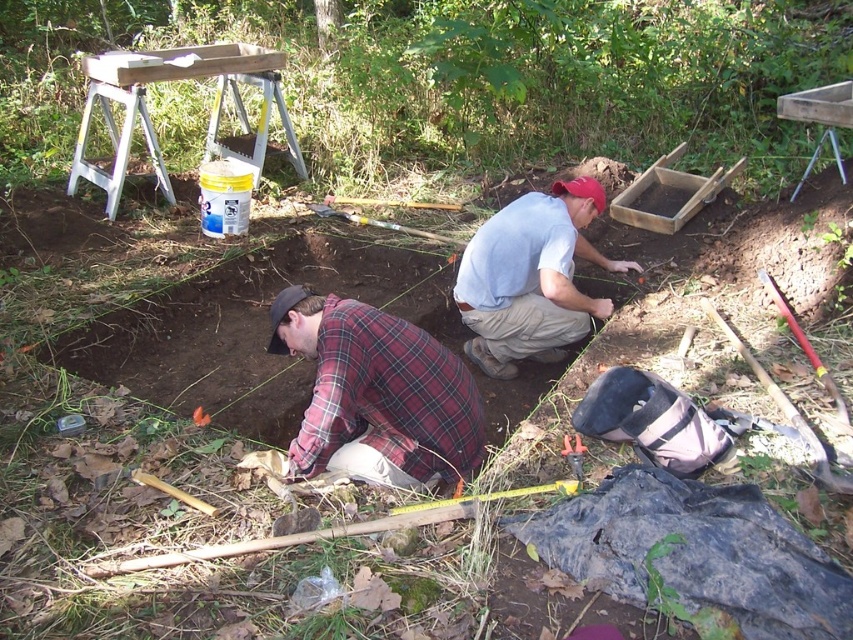
Identify the location of plaid fabric shirt at lower left. The image size is (853, 640). (376, 394).

Does plaid fabric shirt at lower left have a larger size compared to metallic silver hammer at lower center?

Indeed, plaid fabric shirt at lower left has a larger size compared to metallic silver hammer at lower center.

Is point (335, 328) positioned after point (569, 451)?

That is False.

This screenshot has width=853, height=640. Identify the location of plaid fabric shirt at lower left. (376, 394).

What do you see at coordinates (531, 276) in the screenshot?
I see `white cotton shirt at center` at bounding box center [531, 276].

Where is `white cotton shirt at center`? white cotton shirt at center is located at coordinates point(531,276).

Is point (521, 246) closer to viewer compared to point (561, 449)?

No, (521, 246) is further to viewer.

This screenshot has width=853, height=640. What are the coordinates of `white cotton shirt at center` in the screenshot? It's located at (531, 276).

Is plaid fabric shirt at lower left above white cotton shirt at center?

Actually, plaid fabric shirt at lower left is below white cotton shirt at center.

You are a GUI agent. You are given a task and a screenshot of the screen. Output one action in this format:
    pyautogui.click(x=<x>, y=<y>)
    Task: Click on the plaid fabric shirt at lower left
    
    Given the screenshot: What is the action you would take?
    pyautogui.click(x=376, y=394)